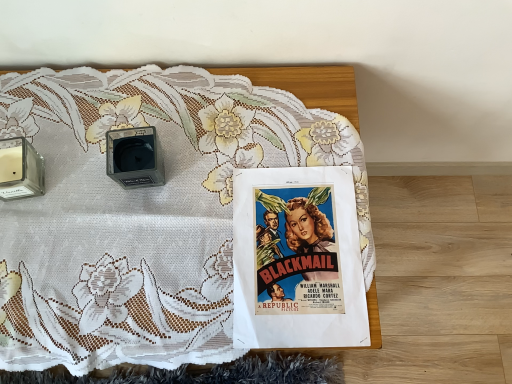
This screenshot has width=512, height=384. Identify the location of vacant space that's between matte black speaker at center, positioned as the 2th speaker in left-to-right order, and transparent glass candle at left, acting as the first speaker starting from the left. (74, 170).